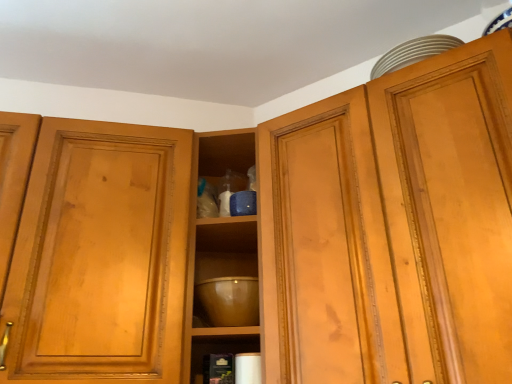
Question: Considering the relative sizes of transparent glass cabinet at upper center and glossy ceramic mixing bowl at center in the image provided, is transparent glass cabinet at upper center bigger than glossy ceramic mixing bowl at center?

Choices:
 (A) no
 (B) yes

Answer: (B)

Question: From a real-world perspective, is transparent glass cabinet at upper center positioned under glossy ceramic mixing bowl at center based on gravity?

Choices:
 (A) yes
 (B) no

Answer: (B)

Question: Is transparent glass cabinet at upper center further to the viewer compared to glossy ceramic mixing bowl at center?

Choices:
 (A) no
 (B) yes

Answer: (A)

Question: From the image's perspective, would you say transparent glass cabinet at upper center is shown under glossy ceramic mixing bowl at center?

Choices:
 (A) no
 (B) yes

Answer: (A)

Question: Does transparent glass cabinet at upper center have a lesser width compared to glossy ceramic mixing bowl at center?

Choices:
 (A) yes
 (B) no

Answer: (B)

Question: Looking at their shapes, would you say matte wood cabinet at upper right is wider or thinner than glossy ceramic mixing bowl at center?

Choices:
 (A) wide
 (B) thin

Answer: (A)

Question: Based on their sizes in the image, would you say matte wood cabinet at upper right is bigger or smaller than glossy ceramic mixing bowl at center?

Choices:
 (A) small
 (B) big

Answer: (B)

Question: Considering the positions of matte wood cabinet at upper right and glossy ceramic mixing bowl at center in the image, is matte wood cabinet at upper right taller or shorter than glossy ceramic mixing bowl at center?

Choices:
 (A) short
 (B) tall

Answer: (B)

Question: From a real-world perspective, is matte wood cabinet at upper right physically located above or below glossy ceramic mixing bowl at center?

Choices:
 (A) below
 (B) above

Answer: (B)

Question: Would you say glossy ceramic mixing bowl at center is to the left or to the right of matte wood cabinet at upper right in the picture?

Choices:
 (A) left
 (B) right

Answer: (A)

Question: Choose the correct answer: Is glossy ceramic mixing bowl at center inside matte wood cabinet at upper right or outside it?

Choices:
 (A) outside
 (B) inside

Answer: (A)

Question: Based on their sizes in the image, would you say glossy ceramic mixing bowl at center is bigger or smaller than matte wood cabinet at upper right?

Choices:
 (A) big
 (B) small

Answer: (B)

Question: Considering the positions of point (234, 306) and point (327, 286), is point (234, 306) closer or farther from the camera than point (327, 286)?

Choices:
 (A) farther
 (B) closer

Answer: (A)

Question: Does point (308, 114) appear closer or farther from the camera than point (178, 309)?

Choices:
 (A) closer
 (B) farther

Answer: (B)

Question: Is matte wood cabinet at upper right to the left or to the right of transparent glass cabinet at upper center in the image?

Choices:
 (A) right
 (B) left

Answer: (A)